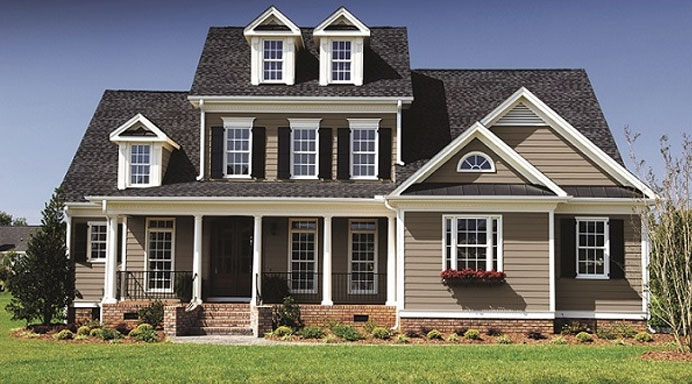
Where is `windows on the ground floor`? windows on the ground floor is located at coordinates (471, 248), (592, 251), (362, 247), (300, 254), (158, 249), (99, 244).